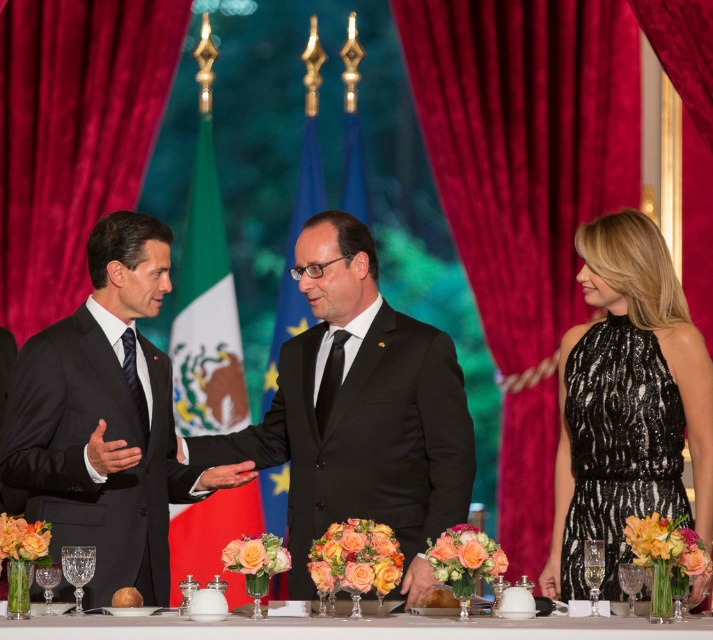
Which of these two, velvet red curtain at left or black sequined dress at right, stands taller?

velvet red curtain at left

In the scene shown: Does velvet red curtain at left have a lesser height compared to black sequined dress at right?

Incorrect, velvet red curtain at left's height does not fall short of black sequined dress at right's.

Looking at this image, measure the distance between velvet red curtain at left and camera.

velvet red curtain at left is 14.40 meters away from camera.

Find the location of a particular element. velvet red curtain at left is located at coordinates (73, 136).

Which is in front, point (158, 442) or point (386, 632)?

Positioned in front is point (386, 632).

Consider the image. Is black satin suit at left to the left of white ceramic table at center from the viewer's perspective?

Yes, black satin suit at left is to the left of white ceramic table at center.

Between point (96, 602) and point (540, 634), which one is positioned in front?

Point (540, 634) is more forward.

Where is `black satin suit at left`? This screenshot has height=640, width=713. black satin suit at left is located at coordinates (106, 419).

Based on the photo, is black suit at center thinner than white ceramic table at center?

Yes.

Can you confirm if black suit at center is wider than white ceramic table at center?

No, black suit at center is not wider than white ceramic table at center.

The width and height of the screenshot is (713, 640). Identify the location of black suit at center. (359, 412).